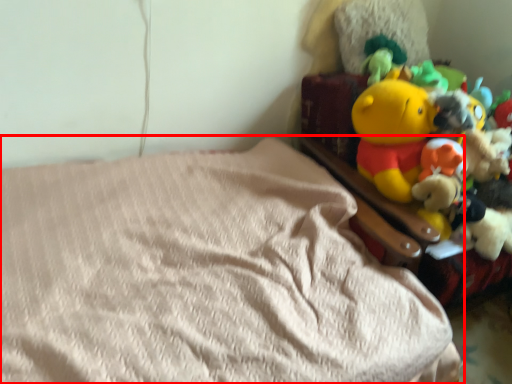
Question: From the image's perspective, what is the correct spatial positioning of bed (annotated by the red box) in reference to toy?

Choices:
 (A) below
 (B) above

Answer: (A)